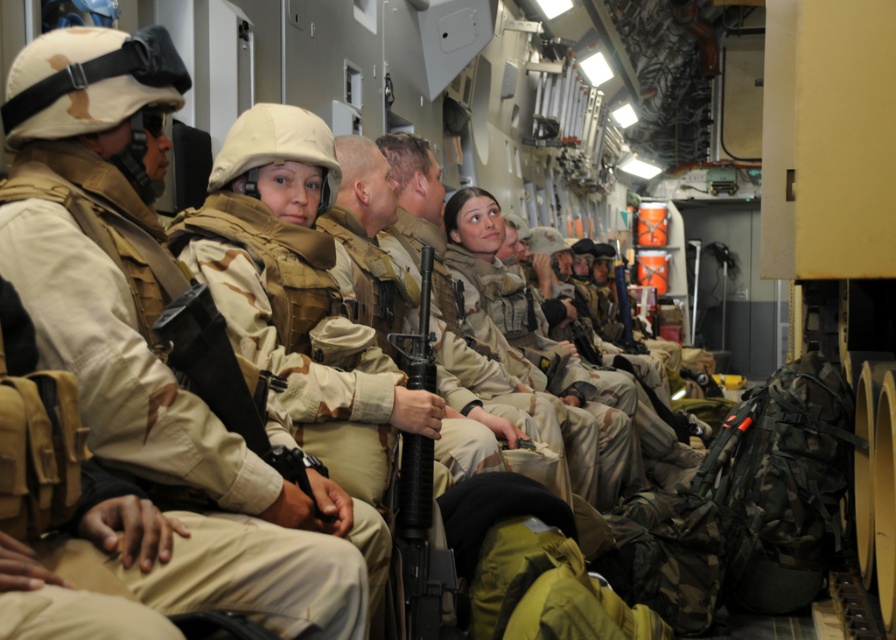
You are a military medic assessing the seating arrangement in the vehicle. You need to quickly determine which item occupies more vertical space between the camouflage uniform at left and the black matte rifle at center. Which one is taller?

The camouflage uniform at left is taller than the black matte rifle at center according to the description.